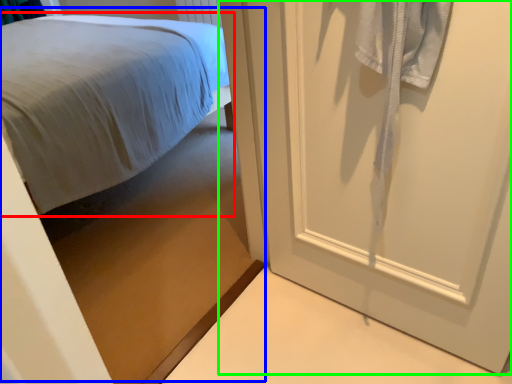
Question: Based on their relative distances, which object is nearer to bed (highlighted by a red box)? Choose from bed (highlighted by a blue box) and door (highlighted by a green box).

Choices:
 (A) bed
 (B) door

Answer: (A)